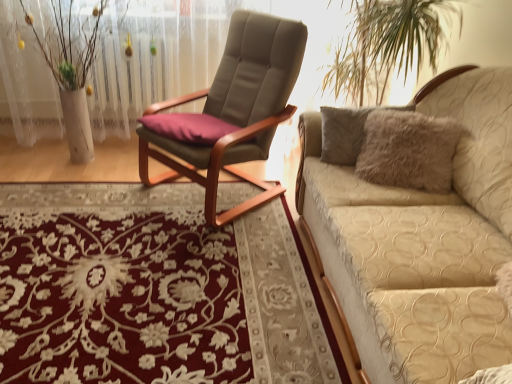
Question: Could you tell me if suede-like beige chair at center is facing white textured vase at left?

Choices:
 (A) no
 (B) yes

Answer: (A)

Question: Does suede-like beige chair at center lie in front of white textured vase at left?

Choices:
 (A) yes
 (B) no

Answer: (A)

Question: From the image's perspective, does suede-like beige chair at center appear higher than white textured vase at left?

Choices:
 (A) no
 (B) yes

Answer: (A)

Question: Considering the relative sizes of suede-like beige chair at center and white textured vase at left in the image provided, is suede-like beige chair at center taller than white textured vase at left?

Choices:
 (A) yes
 (B) no

Answer: (B)

Question: Is suede-like beige chair at center smaller than white textured vase at left?

Choices:
 (A) yes
 (B) no

Answer: (B)

Question: Considering the relative positions of suede-like beige chair at center and white textured vase at left in the image provided, is suede-like beige chair at center to the right of white textured vase at left from the viewer's perspective?

Choices:
 (A) yes
 (B) no

Answer: (A)

Question: Is suede-like beige chair at center located within beige quilted couch at right?

Choices:
 (A) no
 (B) yes

Answer: (A)

Question: Considering the relative sizes of beige quilted couch at right and suede-like beige chair at center in the image provided, is beige quilted couch at right taller than suede-like beige chair at center?

Choices:
 (A) yes
 (B) no

Answer: (B)

Question: Does beige quilted couch at right have a lesser height compared to suede-like beige chair at center?

Choices:
 (A) yes
 (B) no

Answer: (A)

Question: Is beige quilted couch at right wider than suede-like beige chair at center?

Choices:
 (A) yes
 (B) no

Answer: (A)

Question: From a real-world perspective, does beige quilted couch at right sit lower than suede-like beige chair at center?

Choices:
 (A) yes
 (B) no

Answer: (A)

Question: Could you tell me if beige quilted couch at right is turned towards suede-like beige chair at center?

Choices:
 (A) no
 (B) yes

Answer: (B)

Question: Is suede-like beige chair at center to the left of beige quilted couch at right from the viewer's perspective?

Choices:
 (A) yes
 (B) no

Answer: (A)